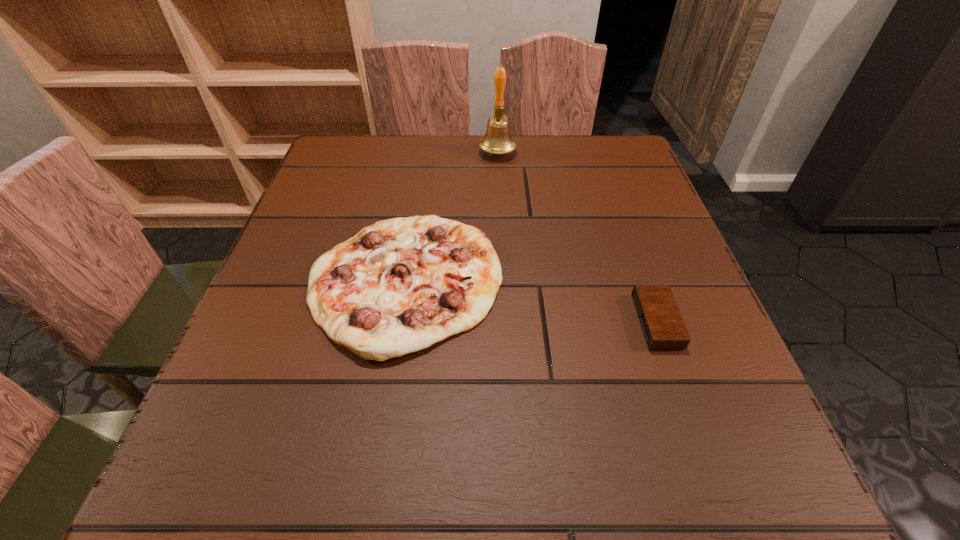
Locate an element on the screen. object that is the second nearest to the pizza is located at coordinates (663, 327).

Locate an element on the screen. The width and height of the screenshot is (960, 540). the second closest object to the pizza is located at coordinates (663, 327).